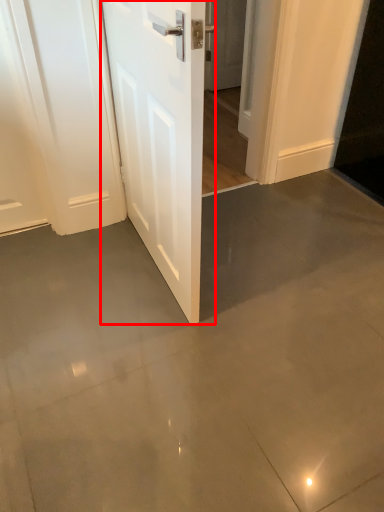
Question: Where is door (annotated by the red box) located in relation to door in the image?

Choices:
 (A) right
 (B) left

Answer: (B)